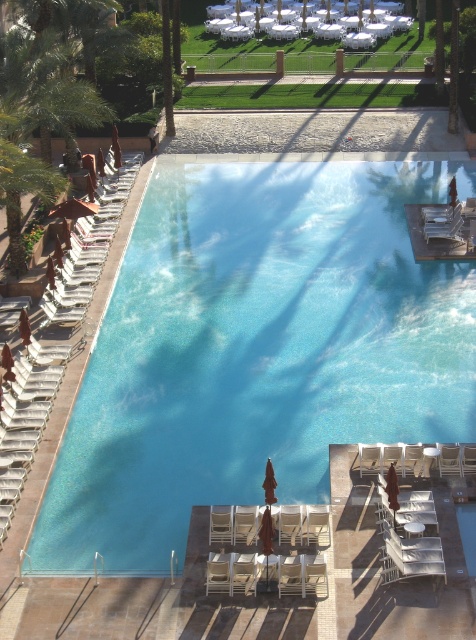
Is point (10, 244) more distant than point (220, 516)?

Yes.

Does green leafy palm tree at left appear on the right side of beige fabric beach chair at lower center?

In fact, green leafy palm tree at left is to the left of beige fabric beach chair at lower center.

This screenshot has width=476, height=640. Find the location of `green leafy palm tree at left`. green leafy palm tree at left is located at coordinates (22, 193).

At what (x,y) coordinates should I click in order to perform the action: click on green leafy palm tree at left. Please return your answer as a coordinate pair (x, y). Looking at the image, I should click on (22, 193).

Is point (395, 182) positioned in front of point (15, 157)?

No, (395, 182) is behind (15, 157).

This screenshot has height=640, width=476. Find the location of `clear glass swimming pool at center`. clear glass swimming pool at center is located at coordinates (257, 349).

Is clear glass swimming pool at center below beige fabric beach chair at lower center?

Actually, clear glass swimming pool at center is above beige fabric beach chair at lower center.

Can you confirm if clear glass swimming pool at center is positioned to the left of beige fabric beach chair at lower center?

Incorrect, clear glass swimming pool at center is not on the left side of beige fabric beach chair at lower center.

Measure the distance between clear glass swimming pool at center and camera.

They are 52.95 feet apart.

Locate an element on the screen. This screenshot has width=476, height=640. clear glass swimming pool at center is located at coordinates (257, 349).